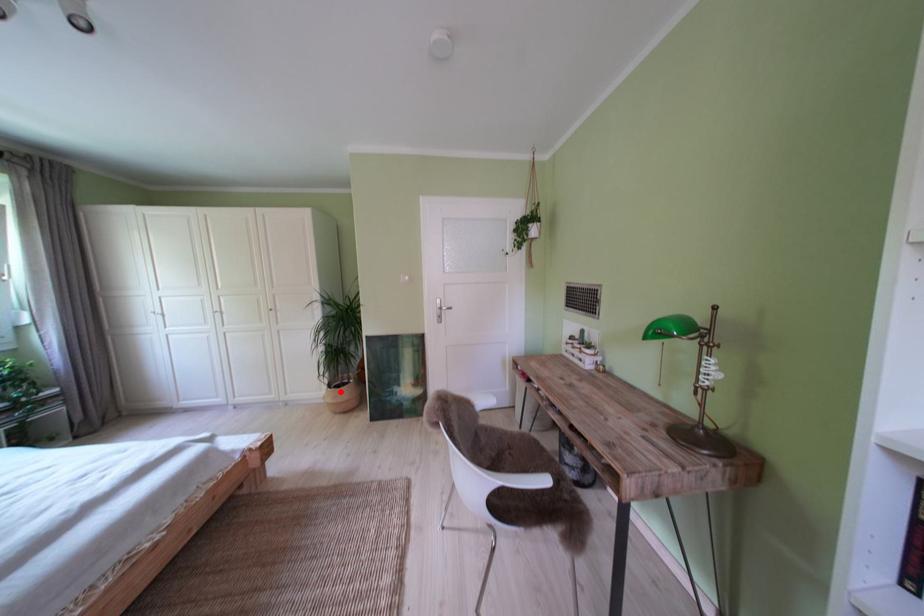
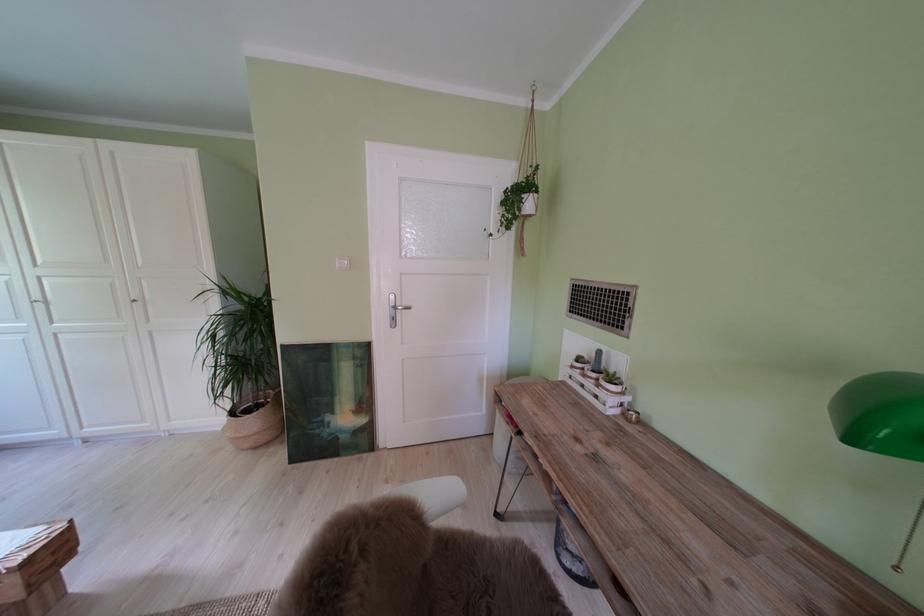
Question: A red point is marked in image1. In image2, is the corresponding 3D point closer to the camera or farther? Reply with the corresponding letter.

Choices:
 (A) The corresponding 3D point is closer.
 (B) The corresponding 3D point is farther.

Answer: (B)